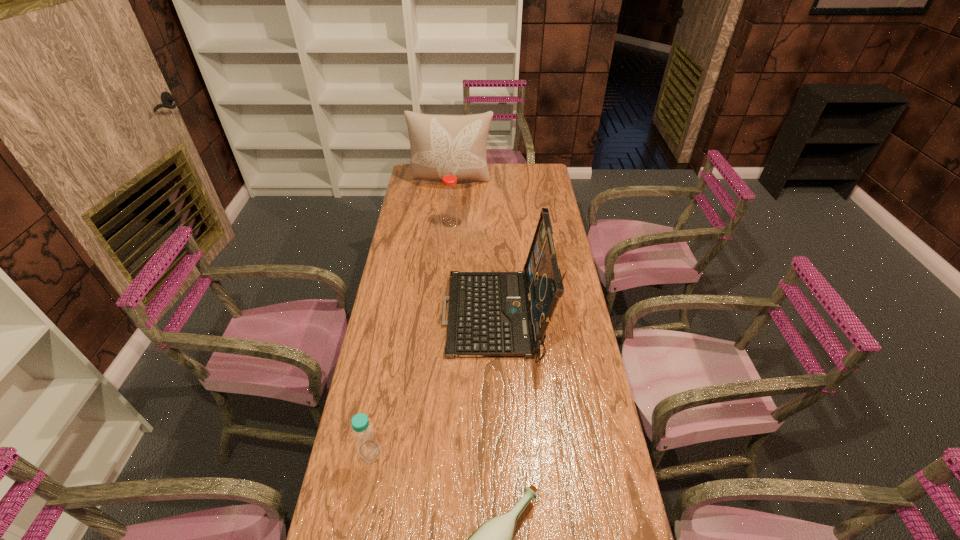
Identify the location of vacant area between the farthest object and the second shortest object. Image resolution: width=960 pixels, height=540 pixels. (411, 315).

You are a GUI agent. You are given a task and a screenshot of the screen. Output one action in this format:
    pyautogui.click(x=<x>, y=<y>)
    Task: Click on the empty space between the cushion and the fourth tallest object
    Image resolution: width=960 pixels, height=540 pixels.
    Given the screenshot: What is the action you would take?
    pyautogui.click(x=411, y=315)

The height and width of the screenshot is (540, 960). In order to click on vacant area between the third farthest object and the farthest object in this screenshot , I will do `click(474, 249)`.

You are a GUI agent. You are given a task and a screenshot of the screen. Output one action in this format:
    pyautogui.click(x=<x>, y=<y>)
    Task: Click on the free area in between the farthest object and the leftmost bottle
    This screenshot has height=540, width=960.
    Given the screenshot: What is the action you would take?
    pyautogui.click(x=411, y=315)

The image size is (960, 540). What are the coordinates of `free area in between the second farthest bottle and the third tallest object` in the screenshot? It's located at (411, 336).

I want to click on the third closest object to the third farthest object, so click(x=493, y=539).

Select which object is the second closest to the shortest object. Please provide its 2D coordinates. Your answer should be formatted as a tuple, i.e. [(x, y)], where the tuple contains the x and y coordinates of a point satisfying the conditions above.

[(491, 314)]

Identify which bottle is located as the second nearest to the farthest bottle. Please provide its 2D coordinates. Your answer should be formatted as a tuple, i.e. [(x, y)], where the tuple contains the x and y coordinates of a point satisfying the conditions above.

[(493, 539)]

Select which bottle is the second closest to the farthest object. Please provide its 2D coordinates. Your answer should be formatted as a tuple, i.e. [(x, y)], where the tuple contains the x and y coordinates of a point satisfying the conditions above.

[(368, 447)]